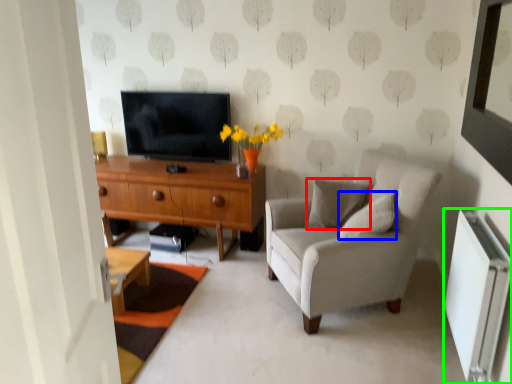
Question: Which object is positioned farthest from pillow (highlighted by a red box)? Select from pillow (highlighted by a blue box) and radiator (highlighted by a green box).

Choices:
 (A) pillow
 (B) radiator

Answer: (B)